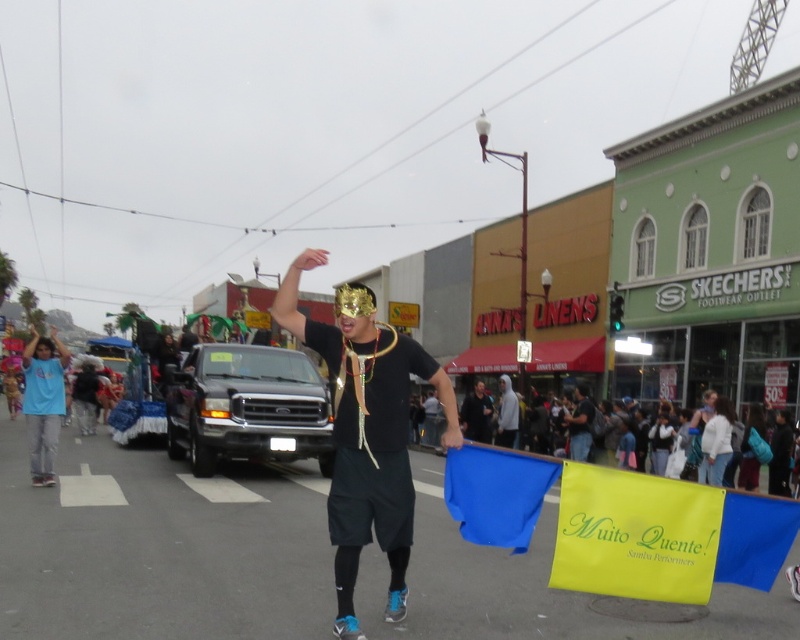
Does black matte mask at center lie in front of light blue t-shirt at left?

Yes, black matte mask at center is closer to the viewer.

Who is more distant from viewer, (352, 570) or (36, 369)?

The point (36, 369) is more distant.

What are the coordinates of `black matte mask at center` in the screenshot? It's located at click(x=366, y=432).

Identify the location of light blue t-shirt at left. The height and width of the screenshot is (640, 800). (44, 401).

Which is more to the left, light blue t-shirt at left or black fabric mask at center?

From the viewer's perspective, light blue t-shirt at left appears more on the left side.

Which is behind, point (44, 470) or point (586, 452)?

The point (586, 452) is behind.

I want to click on light blue t-shirt at left, so [x=44, y=401].

Which is more to the left, black matte mask at center or black fabric mask at center?

black matte mask at center is more to the left.

Who is more forward, (396, 403) or (570, 435)?

Positioned in front is point (396, 403).

Identify the location of black matte mask at center. This screenshot has width=800, height=640. point(366,432).